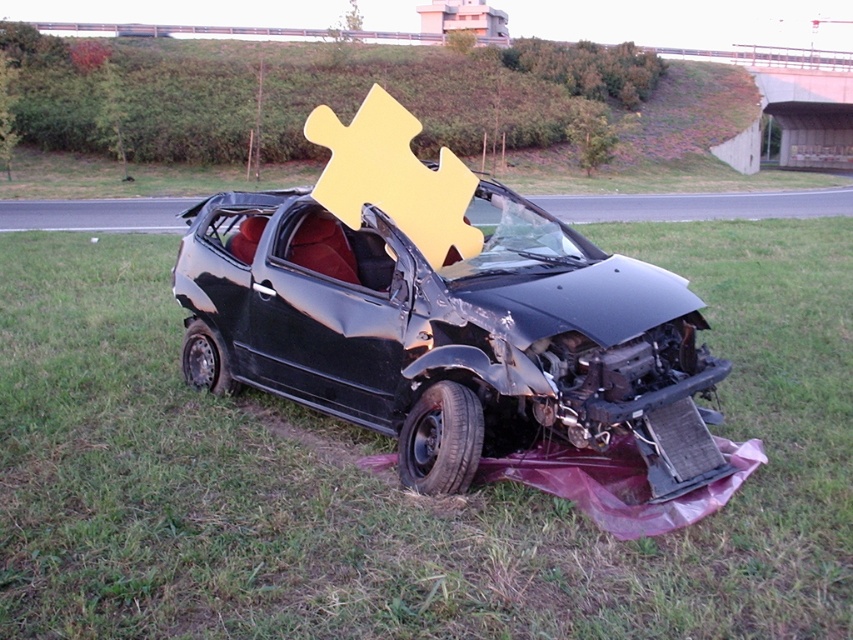
Question: Which point is closer to the camera?

Choices:
 (A) (502, 371)
 (B) (187, 545)

Answer: (B)

Question: Which point is farther to the camera?

Choices:
 (A) (97, 616)
 (B) (497, 225)

Answer: (B)

Question: Observing the image, what is the correct spatial positioning of green grass at center in reference to black matte car at center?

Choices:
 (A) right
 (B) left

Answer: (B)

Question: Does green grass at center lie in front of black matte car at center?

Choices:
 (A) yes
 (B) no

Answer: (A)

Question: Is green grass at center positioned at the back of black matte car at center?

Choices:
 (A) no
 (B) yes

Answer: (A)